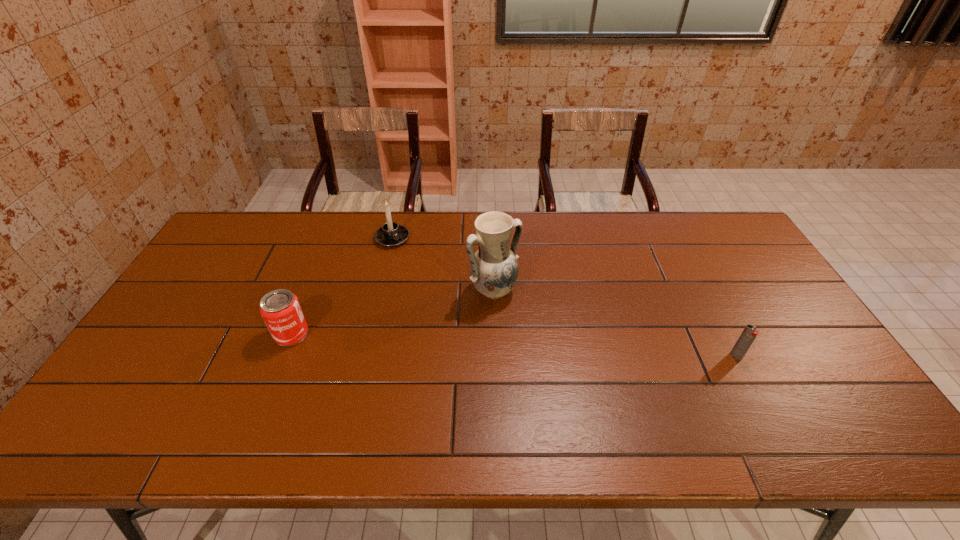
This screenshot has width=960, height=540. I want to click on can, so click(x=280, y=309).

Where is `the third farthest object`? the third farthest object is located at coordinates (280, 309).

The image size is (960, 540). What are the coordinates of `the rightmost object` in the screenshot? It's located at (749, 333).

Find the location of a particular element. This screenshot has height=540, width=960. the nearest object is located at coordinates (749, 333).

Locate an element on the screen. This screenshot has height=540, width=960. the second object from left to right is located at coordinates (391, 234).

In order to click on the farthest object in this screenshot , I will do `click(391, 234)`.

The height and width of the screenshot is (540, 960). What are the coordinates of `the third nearest object` in the screenshot? It's located at (494, 270).

Identify the location of the second object from right to left. (494, 270).

The image size is (960, 540). I want to click on vacant area situated 0.380m on the back of the third farthest object, so click(x=330, y=238).

Locate an element on the screen. free space located 0.140m on the right of the igniter is located at coordinates (795, 356).